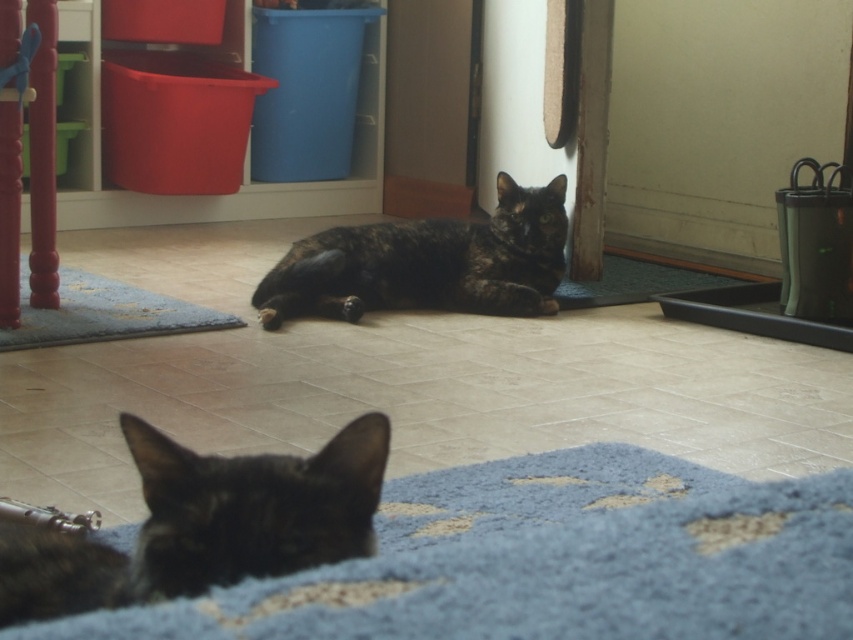
Question: Does tortoiseshell fur cat at center lie in front of blue shaggy mat at lower left?

Choices:
 (A) no
 (B) yes

Answer: (A)

Question: Which point appears closest to the camera in this image?

Choices:
 (A) (115, 621)
 (B) (178, 589)
 (C) (96, 317)
 (D) (525, 228)

Answer: (A)

Question: Which point is closer to the camera taking this photo?

Choices:
 (A) (264, 572)
 (B) (729, 609)

Answer: (B)

Question: Which object appears closest to the camera in this image?

Choices:
 (A) tortoiseshell fur cat at center
 (B) shiny black cat at lower left
 (C) blue shaggy mat at lower left

Answer: (B)

Question: Is shiny black cat at lower left above tortoiseshell fur cat at center?

Choices:
 (A) no
 (B) yes

Answer: (A)

Question: Is shiny black cat at lower left bigger than blue shaggy mat at lower left?

Choices:
 (A) yes
 (B) no

Answer: (B)